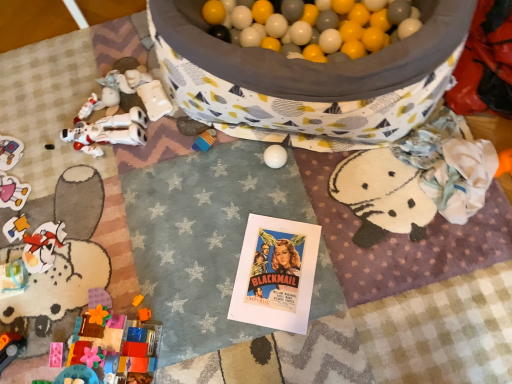
Identify the location of free area in between plastic toy car at lower left, the 1th toy positioned from the back, and brick-like plastic blocks at lower left, which is counted as the 2th toy, starting from the bottom. The height and width of the screenshot is (384, 512). (61, 249).